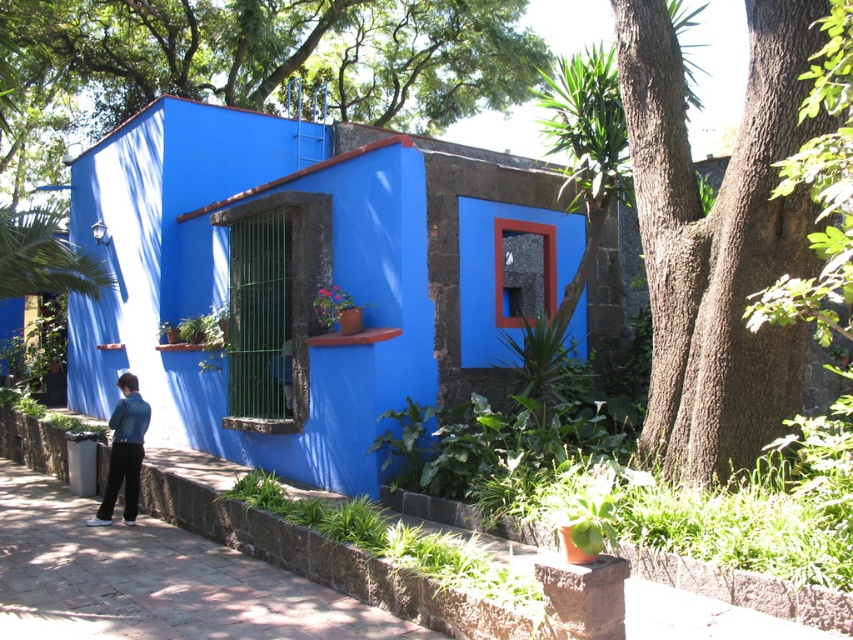
You are standing in front of the building and see the green leafy tree at upper center and the denim jacket at lower left. Which object is taller?

The green leafy tree at upper center is much taller than the denim jacket at lower left.

You are a gardener planning to plant a new tree in the garden. You notice the green leafy tree at upper center and the brown rough bark tree at right. Which tree has a wider canopy?

The green leafy tree at upper center might be wider than the brown rough bark tree at right, so it likely has a wider canopy.